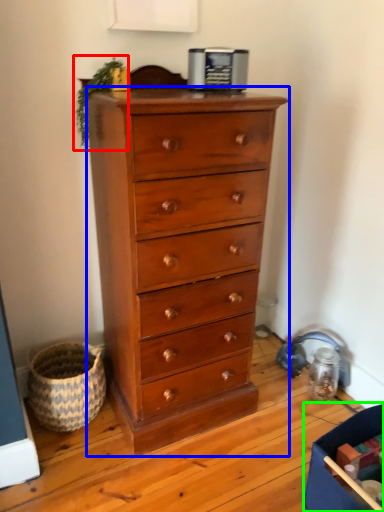
Question: Based on their relative distances, which object is nearer to plant (highlighted by a red box)? Choose from chest of drawers (highlighted by a blue box) and storage box (highlighted by a green box).

Choices:
 (A) chest of drawers
 (B) storage box

Answer: (A)